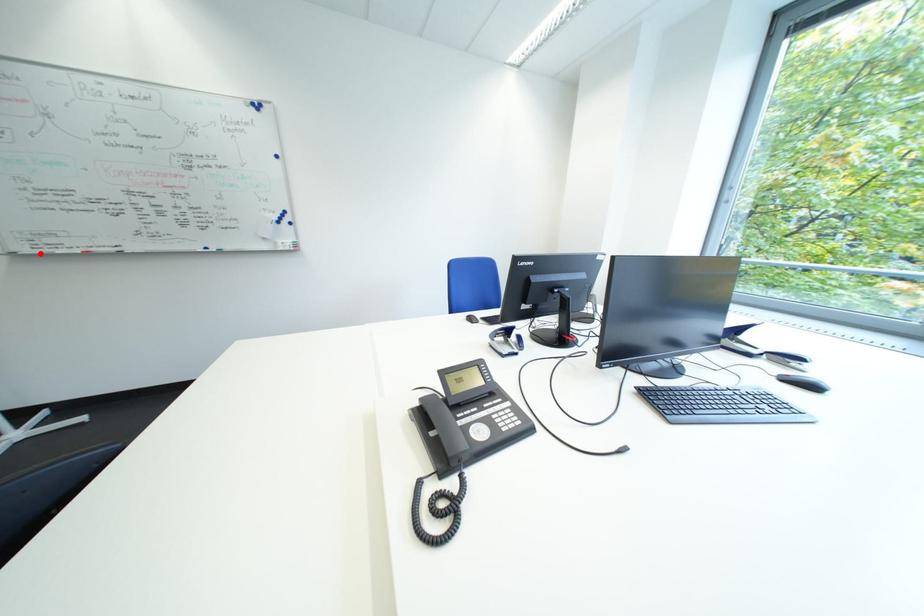
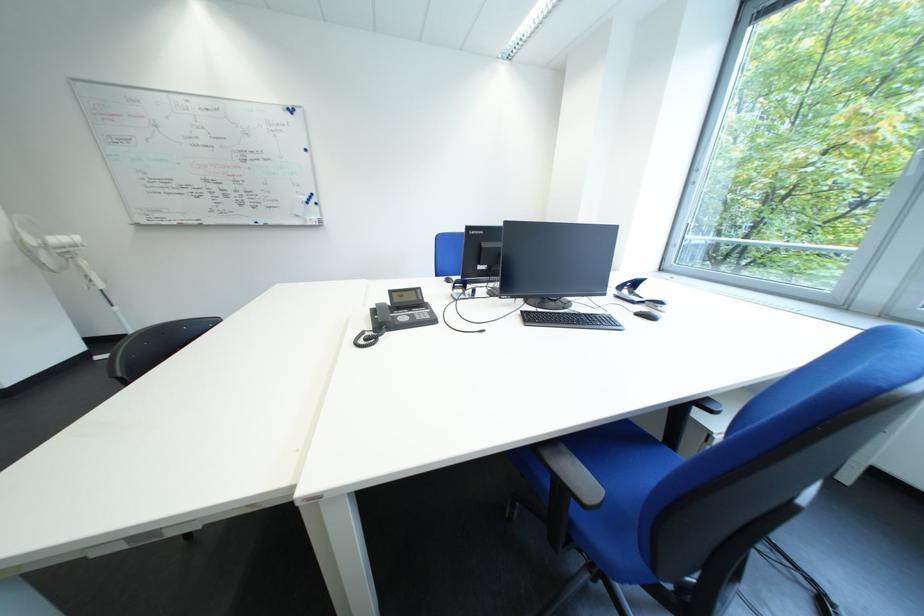
Find the pixel in the second image that matches the highlighted location in the first image.

(157, 225)